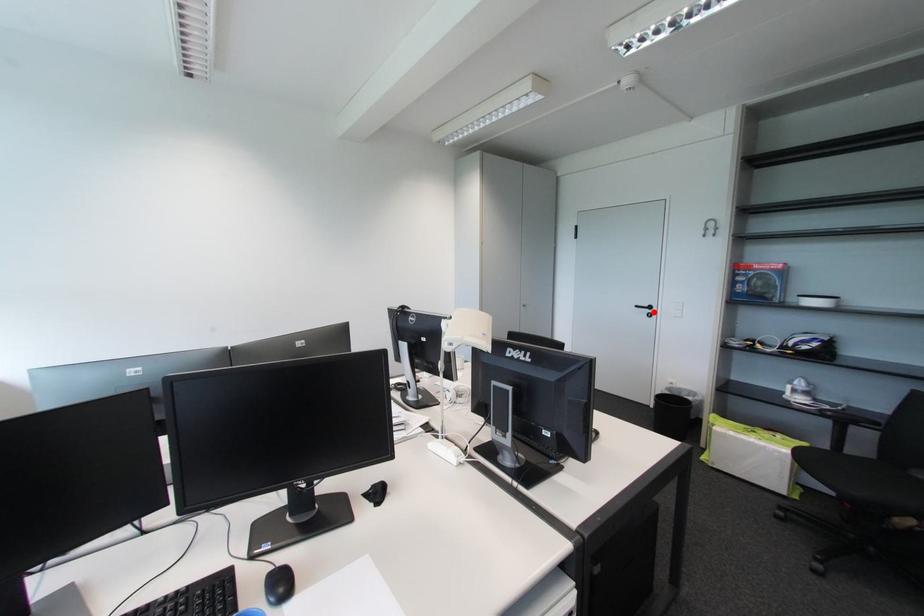
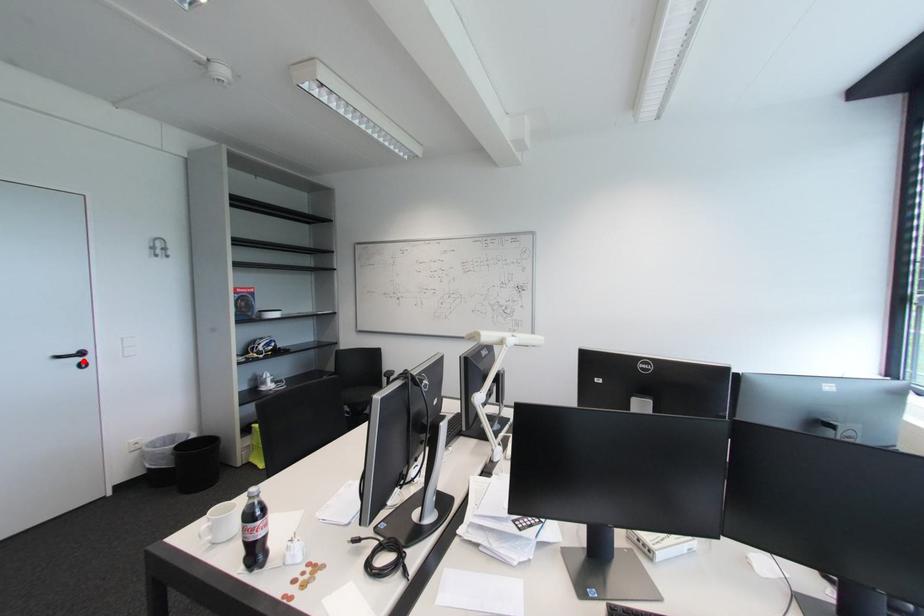
I am providing you with two images of the same scene from different viewpoints. A red point is marked on the first image and another point is marked on the second image. Does the point marked in image1 correspond to the same location as the one in image2?

Yes